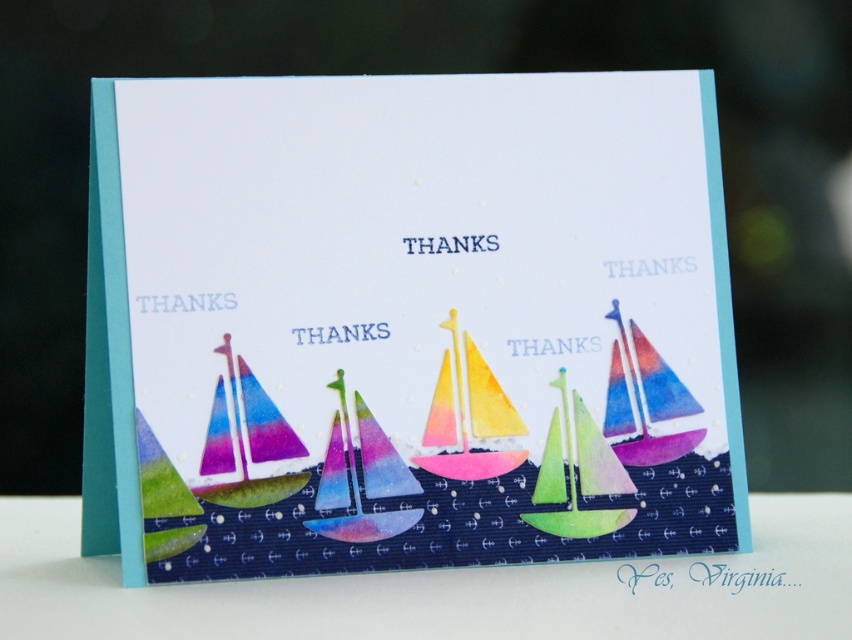
Question: Is watercolor sailboats at lower center to the right of watercolor sailboat at center from the viewer's perspective?

Choices:
 (A) no
 (B) yes

Answer: (A)

Question: Which object appears farthest from the camera in this image?

Choices:
 (A) watercolor sailboats at lower center
 (B) white paper at lower center
 (C) watercolor sailboat at center

Answer: (C)

Question: Among these points, which one is farthest from the camera?

Choices:
 (A) (446, 456)
 (B) (181, 628)

Answer: (A)

Question: Does watercolor sailboats at lower center have a lesser width compared to white paper at lower center?

Choices:
 (A) no
 (B) yes

Answer: (B)

Question: Does white paper at lower center appear under watercolor sailboat at center?

Choices:
 (A) no
 (B) yes

Answer: (B)

Question: Which point is farther to the camera?

Choices:
 (A) watercolor sailboat at center
 (B) white paper at lower center
 (C) watercolor sailboats at lower center

Answer: (A)